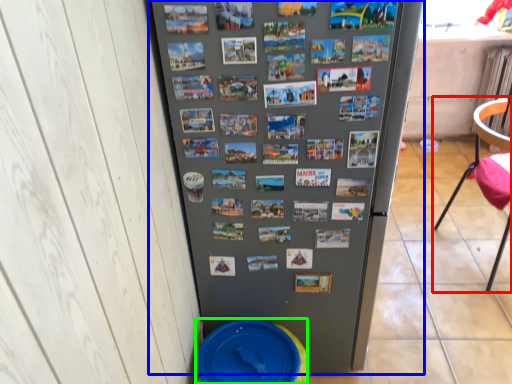
Question: Based on their relative distances, which object is nearer to chair (highlighted by a red box)? Choose from refrigerator (highlighted by a blue box) and potty (highlighted by a green box).

Choices:
 (A) refrigerator
 (B) potty

Answer: (A)